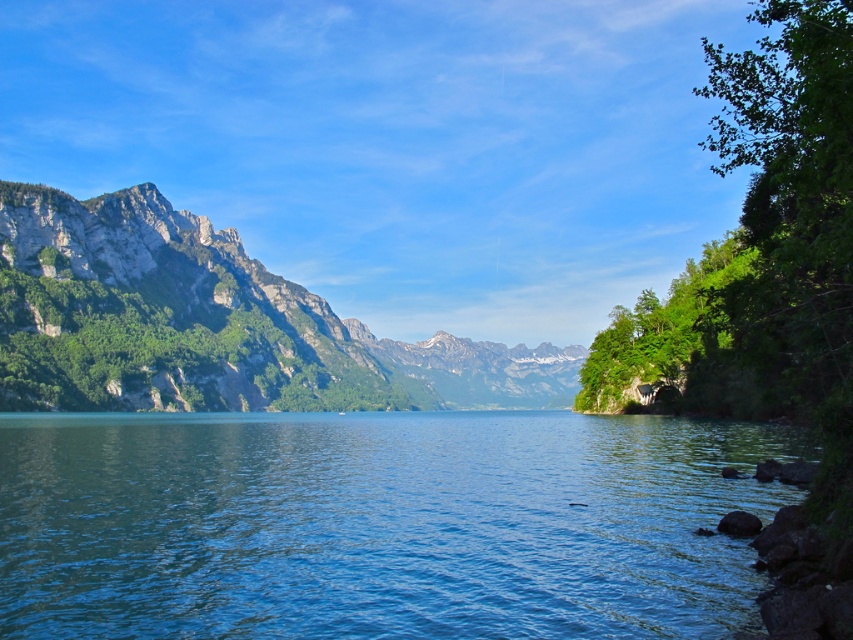
Who is taller, green water at center or rugged stone mountain at left?

With more height is rugged stone mountain at left.

Is point (689, 625) positioned behind point (82, 250)?

No, (689, 625) is closer to viewer.

Where is `green water at center`? Image resolution: width=853 pixels, height=640 pixels. green water at center is located at coordinates (379, 524).